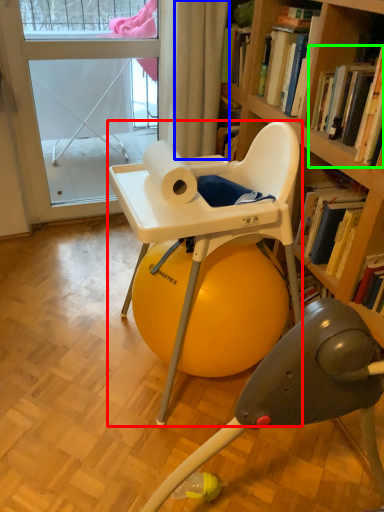
Question: Which is farther away from chair (highlighted by a red box)? curtain (highlighted by a blue box) or book (highlighted by a green box)?

Choices:
 (A) curtain
 (B) book

Answer: (A)